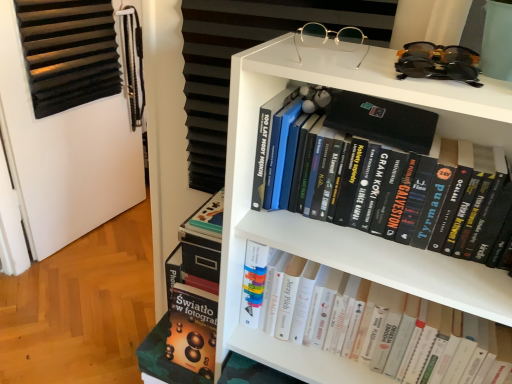
Measure the distance between point (368,43) and camera.

The depth of point (368,43) is 38.27 inches.

This screenshot has height=384, width=512. What do you see at coordinates (334, 225) in the screenshot? I see `white matte bookcase at upper center` at bounding box center [334, 225].

At what (x,y) coordinates should I click in order to perform the action: click on gold metallic glasses at upper center, marked as the 1th glasses in a left-to-right arrangement. Please return your answer as a coordinate pair (x, y). This screenshot has height=384, width=512. Looking at the image, I should click on (331, 39).

Considering the relative sizes of gold metallic glasses at upper center, marked as the 1th glasses in a left-to-right arrangement, and hardcover books at center, which is the 2th book from top to bottom, in the image provided, is gold metallic glasses at upper center, marked as the 1th glasses in a left-to-right arrangement, wider than hardcover books at center, which is the 2th book from top to bottom,?

No.

Is gold metallic glasses at upper center, marked as the 1th glasses in a left-to-right arrangement, next to hardcover books at center, which is the 2th book from top to bottom, and touching it?

gold metallic glasses at upper center, marked as the 1th glasses in a left-to-right arrangement, is not next to hardcover books at center, which is the 2th book from top to bottom, and they're not touching.

This screenshot has width=512, height=384. Identify the location of the 1st glasses located above the hardcover books at center, which is the 2th book from top to bottom (from a real-world perspective). (331, 39).

From the image's perspective, is gold metallic glasses at upper center, the 2th glasses viewed from the right, on hardcover books at center, which is the 2th book from top to bottom?

Yes, from the image's perspective, gold metallic glasses at upper center, the 2th glasses viewed from the right, is on top of hardcover books at center, which is the 2th book from top to bottom.

Does black matte book at upper center, the 2th book from the bottom, appear on the left side of hardcover books at center, which is the 2th book from top to bottom?

Yes.

Consider the image. Between black matte book at upper center, the first book positioned from the top, and hardcover books at center, which is the 2th book from top to bottom, which one has smaller width?

With smaller width is black matte book at upper center, the first book positioned from the top.

From a real-world perspective, is black matte book at upper center, the 2th book from the bottom, located higher than hardcover books at center, which is the first book from bottom to top?

Indeed, from a real-world perspective, black matte book at upper center, the 2th book from the bottom, stands above hardcover books at center, which is the first book from bottom to top.

Which of these two, black matte book at upper center, the 2th book from the bottom, or hardcover books at center, which is the 2th book from top to bottom, is smaller?

With smaller size is black matte book at upper center, the 2th book from the bottom.

At what (x,y) coordinates should I click in order to perform the action: click on glasses that is the 2nd object located in front of the hardcover books at center, which is the 2th book from top to bottom. Please return your answer as a coordinate pair (x, y). Looking at the image, I should click on (438, 62).

Which object is closer to the camera, hardcover books at center, which is the 2th book from top to bottom, or black plastic sunglasses at upper right, marked as the 1th glasses in a right-to-left arrangement?

black plastic sunglasses at upper right, marked as the 1th glasses in a right-to-left arrangement.

Considering the sizes of objects hardcover books at center, which is the first book from bottom to top, and black plastic sunglasses at upper right, marked as the 1th glasses in a right-to-left arrangement, in the image provided, who is thinner, hardcover books at center, which is the first book from bottom to top, or black plastic sunglasses at upper right, marked as the 1th glasses in a right-to-left arrangement,?

black plastic sunglasses at upper right, marked as the 1th glasses in a right-to-left arrangement.

From the image's perspective, between hardcover books at center, which is the first book from bottom to top, and black plastic sunglasses at upper right, the 2th glasses when ordered from left to right, who is located below?

From the image's view, hardcover books at center, which is the first book from bottom to top, is below.

Can you confirm if gold metallic glasses at upper center, the 2th glasses viewed from the right, is smaller than white matte bookcase at upper center?

Yes, gold metallic glasses at upper center, the 2th glasses viewed from the right, is smaller than white matte bookcase at upper center.

Does gold metallic glasses at upper center, the 2th glasses viewed from the right, have a greater width compared to white matte bookcase at upper center?

Yes.

Are gold metallic glasses at upper center, the 2th glasses viewed from the right, and white matte bookcase at upper center located far from each other?

No.

Locate an element on the screen. bookcase below the gold metallic glasses at upper center, the 2th glasses viewed from the right (from the image's perspective) is located at coordinates (334, 225).

Based on the photo, from the image's perspective, is hardcover books at center, which is the first book from bottom to top, on gold metallic glasses at upper center, the 2th glasses viewed from the right?

No, from the image's perspective, hardcover books at center, which is the first book from bottom to top, is not over gold metallic glasses at upper center, the 2th glasses viewed from the right.

Which of these two, hardcover books at center, which is the 2th book from top to bottom, or gold metallic glasses at upper center, marked as the 1th glasses in a left-to-right arrangement, is bigger?

hardcover books at center, which is the 2th book from top to bottom, is bigger.

Is gold metallic glasses at upper center, marked as the 1th glasses in a left-to-right arrangement, inside hardcover books at center, which is the first book from bottom to top?

No.

Is hardcover books at center, which is the first book from bottom to top, turned away from gold metallic glasses at upper center, the 2th glasses viewed from the right?

Answer: No, hardcover books at center, which is the first book from bottom to top, is not facing the opposite direction of gold metallic glasses at upper center, the 2th glasses viewed from the right.

Is hardcover books at center, which is the first book from bottom to top, with black matte book at upper center, the first book positioned from the top?

No.

Is hardcover books at center, which is the first book from bottom to top, positioned with its back to black matte book at upper center, the first book positioned from the top?

hardcover books at center, which is the first book from bottom to top, is not turned away from black matte book at upper center, the first book positioned from the top.

From the image's perspective, which object appears higher, hardcover books at center, which is the 2th book from top to bottom, or black matte book at upper center, the 2th book from the bottom?

black matte book at upper center, the 2th book from the bottom.

Would you say hardcover books at center, which is the 2th book from top to bottom, contains black matte book at upper center, the first book positioned from the top?

Result: No, black matte book at upper center, the first book positioned from the top, is not surrounded by hardcover books at center, which is the 2th book from top to bottom.

Considering the sizes of black plastic sunglasses at upper right, the 2th glasses when ordered from left to right, and gold metallic glasses at upper center, the 2th glasses viewed from the right, in the image, is black plastic sunglasses at upper right, the 2th glasses when ordered from left to right, wider or thinner than gold metallic glasses at upper center, the 2th glasses viewed from the right,?

Considering their sizes, black plastic sunglasses at upper right, the 2th glasses when ordered from left to right, looks broader than gold metallic glasses at upper center, the 2th glasses viewed from the right.

From the image's perspective, is black plastic sunglasses at upper right, marked as the 1th glasses in a right-to-left arrangement, above gold metallic glasses at upper center, the 2th glasses viewed from the right?

No, from the image's perspective, black plastic sunglasses at upper right, marked as the 1th glasses in a right-to-left arrangement, is not on top of gold metallic glasses at upper center, the 2th glasses viewed from the right.

Is black plastic sunglasses at upper right, the 2th glasses when ordered from left to right, facing towards gold metallic glasses at upper center, marked as the 1th glasses in a left-to-right arrangement?

No, black plastic sunglasses at upper right, the 2th glasses when ordered from left to right, is not oriented towards gold metallic glasses at upper center, marked as the 1th glasses in a left-to-right arrangement.

Considering the relative positions of black plastic sunglasses at upper right, the 2th glasses when ordered from left to right, and gold metallic glasses at upper center, marked as the 1th glasses in a left-to-right arrangement, in the image provided, is black plastic sunglasses at upper right, the 2th glasses when ordered from left to right, to the left or to the right of gold metallic glasses at upper center, marked as the 1th glasses in a left-to-right arrangement,?

In the image, black plastic sunglasses at upper right, the 2th glasses when ordered from left to right, appears on the right side of gold metallic glasses at upper center, marked as the 1th glasses in a left-to-right arrangement.

From the image's perspective, count 2nd glassess upward from the hardcover books at center, which is the first book from bottom to top, and point to it. Please provide its 2D coordinates.

[(331, 39)]

This screenshot has height=384, width=512. Find the location of `book on the right of the black matte book at upper center, the first book positioned from the top`. book on the right of the black matte book at upper center, the first book positioned from the top is located at coordinates (298, 359).

From the image, which object appears to be farther from black plastic sunglasses at upper right, marked as the 1th glasses in a right-to-left arrangement, hardcover books at center, which is the first book from bottom to top, or black matte book at upper center, the first book positioned from the top?

The object further to black plastic sunglasses at upper right, marked as the 1th glasses in a right-to-left arrangement, is hardcover books at center, which is the first book from bottom to top.

Estimate the real-world distances between objects in this image. Which object is further from hardcover books at center, which is the first book from bottom to top, black matte book at upper center, the 2th book from the bottom, or white matte bookcase at upper center?

black matte book at upper center, the 2th book from the bottom.

Estimate the real-world distances between objects in this image. Which object is further from hardcover books at center, which is the 2th book from top to bottom, gold metallic glasses at upper center, marked as the 1th glasses in a left-to-right arrangement, or black matte book at upper center, the first book positioned from the top?

Among the two, gold metallic glasses at upper center, marked as the 1th glasses in a left-to-right arrangement, is located further to hardcover books at center, which is the 2th book from top to bottom.

From the image, which object appears to be farther from gold metallic glasses at upper center, the 2th glasses viewed from the right, hardcover books at center, which is the first book from bottom to top, or white matte bookcase at upper center?

hardcover books at center, which is the first book from bottom to top, is positioned further to the anchor gold metallic glasses at upper center, the 2th glasses viewed from the right.

Which object lies nearer to the anchor point gold metallic glasses at upper center, the 2th glasses viewed from the right, white matte bookcase at upper center or black matte book at upper center, the first book positioned from the top?

black matte book at upper center, the first book positioned from the top.

From the image, which object appears to be nearer to black matte book at upper center, the 2th book from the bottom, white matte bookcase at upper center or black plastic sunglasses at upper right, the 2th glasses when ordered from left to right?

white matte bookcase at upper center is closer to black matte book at upper center, the 2th book from the bottom.

Looking at this image, based on their spatial positions, is black plastic sunglasses at upper right, the 2th glasses when ordered from left to right, or white matte bookcase at upper center closer to black matte book at upper center, the 2th book from the bottom?

white matte bookcase at upper center is closer to black matte book at upper center, the 2th book from the bottom.

Which object lies further to the anchor point white matte bookcase at upper center, gold metallic glasses at upper center, marked as the 1th glasses in a left-to-right arrangement, or black matte book at upper center, the first book positioned from the top?

gold metallic glasses at upper center, marked as the 1th glasses in a left-to-right arrangement, is further to white matte bookcase at upper center.

This screenshot has width=512, height=384. In order to click on book between gold metallic glasses at upper center, marked as the 1th glasses in a left-to-right arrangement, and hardcover books at center, which is the first book from bottom to top, in the up-down direction in this screenshot , I will do [412, 184].

Find the location of `book between gold metallic glasses at upper center, marked as the 1th glasses in a left-to-right arrangement, and white matte bookcase at upper center from top to bottom`. book between gold metallic glasses at upper center, marked as the 1th glasses in a left-to-right arrangement, and white matte bookcase at upper center from top to bottom is located at coordinates (412, 184).

Where is `glasses between gold metallic glasses at upper center, the 2th glasses viewed from the right, and black matte book at upper center, the first book positioned from the top, in the vertical direction`? glasses between gold metallic glasses at upper center, the 2th glasses viewed from the right, and black matte book at upper center, the first book positioned from the top, in the vertical direction is located at coordinates (438, 62).

Locate an element on the screen. The height and width of the screenshot is (384, 512). glasses between gold metallic glasses at upper center, marked as the 1th glasses in a left-to-right arrangement, and white matte bookcase at upper center from top to bottom is located at coordinates (438, 62).